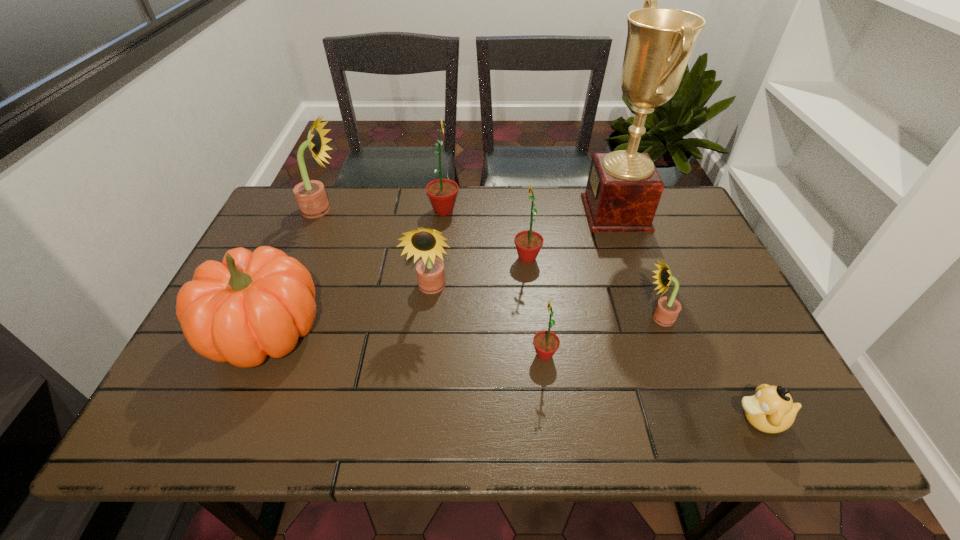
The height and width of the screenshot is (540, 960). In order to click on the nearest yellow sunflower in this screenshot , I will do `click(667, 309)`.

The width and height of the screenshot is (960, 540). What are the coordinates of `the rightmost sunflower` in the screenshot? It's located at (667, 309).

Identify the location of the nearest sunflower. This screenshot has width=960, height=540. (546, 343).

Where is `the smallest green sunflower`? Image resolution: width=960 pixels, height=540 pixels. the smallest green sunflower is located at coordinates (546, 343).

I want to click on the nearest object, so click(x=771, y=410).

This screenshot has width=960, height=540. Find the location of `the shortest object`. the shortest object is located at coordinates (771, 410).

Find the location of a particular element. vacant area situated 0.370m on the plaque of the tallest object is located at coordinates (466, 213).

Identify the location of vacant space located 0.060m on the plaque of the tallest object. The width and height of the screenshot is (960, 540). (565, 213).

At what (x,y) coordinates should I click in order to perform the action: click on free space located 0.070m on the plaque of the tallest object. Please return your answer as a coordinate pair (x, y). The width and height of the screenshot is (960, 540). Looking at the image, I should click on (563, 213).

Where is `vacant space situated on the face of the biggest yellow sunflower`? vacant space situated on the face of the biggest yellow sunflower is located at coordinates [403, 210].